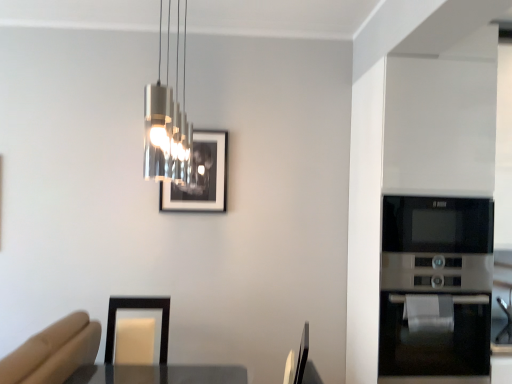
Question: Based on their sizes in the image, would you say metallic cylindrical light fixture at upper center is bigger or smaller than black glass microwave at right?

Choices:
 (A) small
 (B) big

Answer: (A)

Question: Considering the positions of point (168, 31) and point (438, 236), is point (168, 31) closer or farther from the camera than point (438, 236)?

Choices:
 (A) closer
 (B) farther

Answer: (B)

Question: Based on their relative distances, which object is farther from the black glass microwave at right?

Choices:
 (A) metallic cylindrical light fixture at upper center
 (B) matte black picture frame at upper center

Answer: (A)

Question: Estimate the real-world distances between objects in this image. Which object is farther from the metallic cylindrical light fixture at upper center?

Choices:
 (A) black glass microwave at right
 (B) matte black picture frame at upper center

Answer: (A)